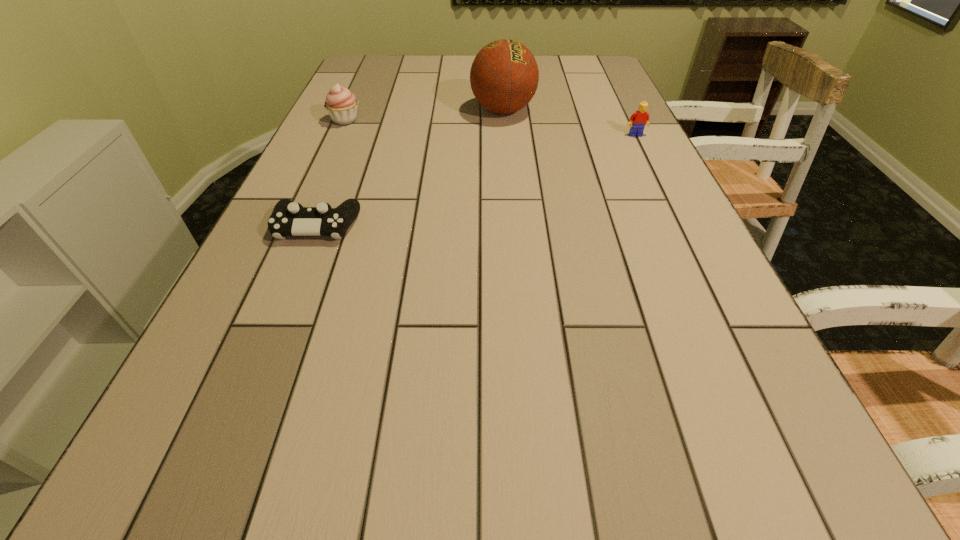
You are a GUI agent. You are given a task and a screenshot of the screen. Output one action in this format:
    pyautogui.click(x=<x>, y=<y>)
    Task: Click on the tallest object
    This screenshot has width=960, height=540.
    Given the screenshot: What is the action you would take?
    pyautogui.click(x=504, y=75)

Where is `the second object from right to left`? the second object from right to left is located at coordinates (504, 75).

Locate an element on the screen. cupcake is located at coordinates (x=341, y=104).

Where is `the second nearest object`? This screenshot has width=960, height=540. the second nearest object is located at coordinates (638, 120).

Locate an element on the screen. This screenshot has height=540, width=960. Lego is located at coordinates tap(638, 120).

This screenshot has height=540, width=960. What are the coordinates of `the nearest object` in the screenshot? It's located at (288, 218).

Image resolution: width=960 pixels, height=540 pixels. I want to click on the shortest object, so click(288, 218).

This screenshot has height=540, width=960. Find the location of `free space located on the front of the tallest object`. free space located on the front of the tallest object is located at coordinates (507, 157).

This screenshot has height=540, width=960. Identify the location of free spot located on the right of the cupcake. (456, 120).

Where is `vacant area situated on the face of the second nearest object`? The width and height of the screenshot is (960, 540). vacant area situated on the face of the second nearest object is located at coordinates (669, 204).